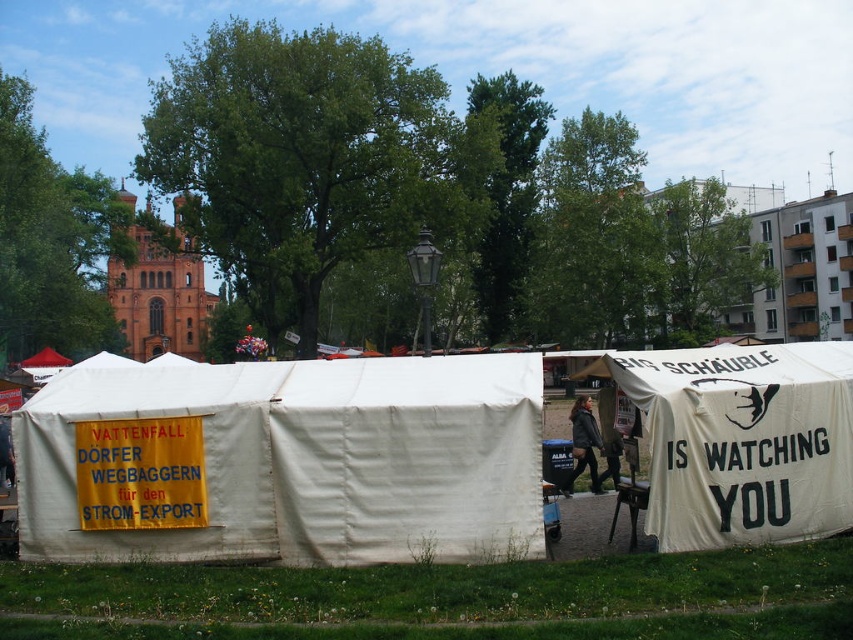
Question: Does white canvas tent at center come behind dark gray leather jacket at center?

Choices:
 (A) no
 (B) yes

Answer: (A)

Question: Does white canvas tent at center appear under white canvas tent at right?

Choices:
 (A) yes
 (B) no

Answer: (B)

Question: Estimate the real-world distances between objects in this image. Which object is closer to the dark gray leather jacket at center?

Choices:
 (A) white canvas tent at right
 (B) white canvas tent at center

Answer: (A)

Question: Which object is the farthest from the dark gray leather jacket at center?

Choices:
 (A) white canvas tent at center
 (B) white canvas tent at right

Answer: (A)

Question: Which object is positioned farthest from the white canvas tent at center?

Choices:
 (A) white canvas tent at right
 (B) dark gray leather jacket at center

Answer: (B)

Question: Is white canvas tent at right further to the viewer compared to dark gray leather jacket at center?

Choices:
 (A) yes
 (B) no

Answer: (B)